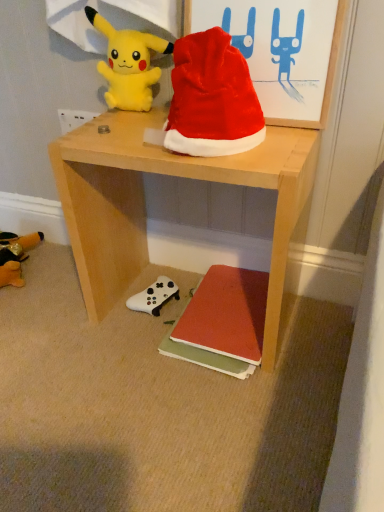
I want to click on vacant area that lies to the right of red matte book at lower center, so click(x=315, y=327).